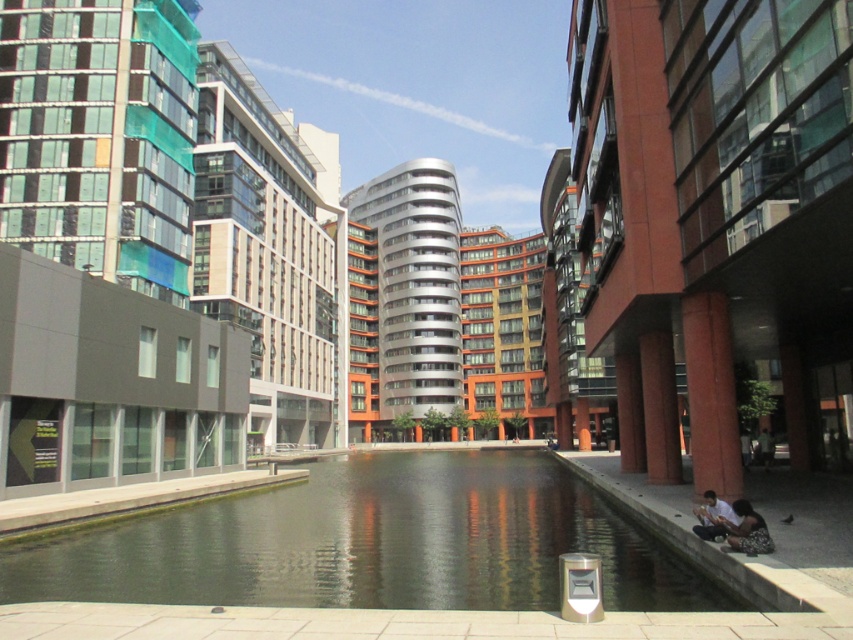
You are standing at the edge of the waterway in the urban scene. There are two points marked in the image. One is at coordinates point (770, 544) and the other is at point (711, 529). Which point is closer to your viewpoint?

Point (770, 544) is closer to the camera than point (711, 529).